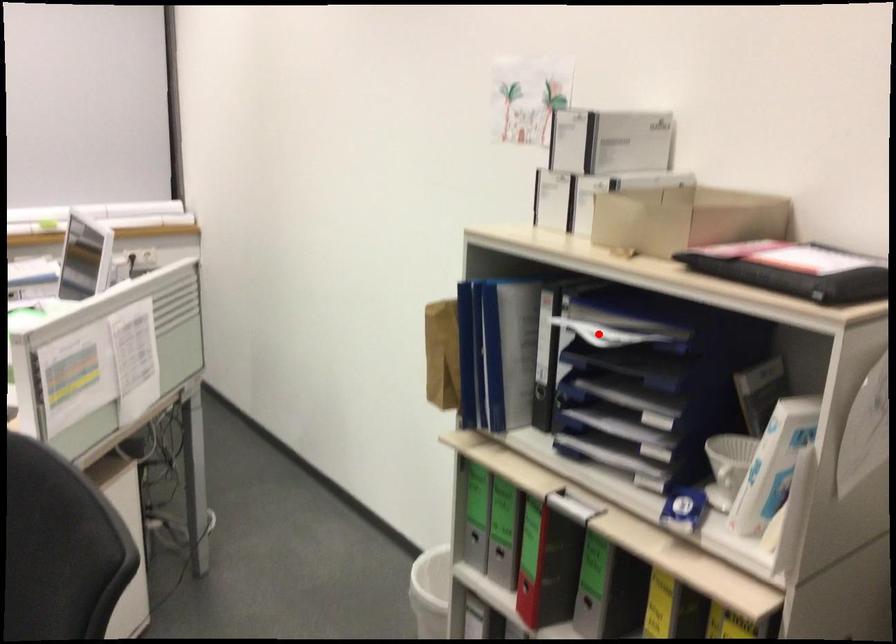
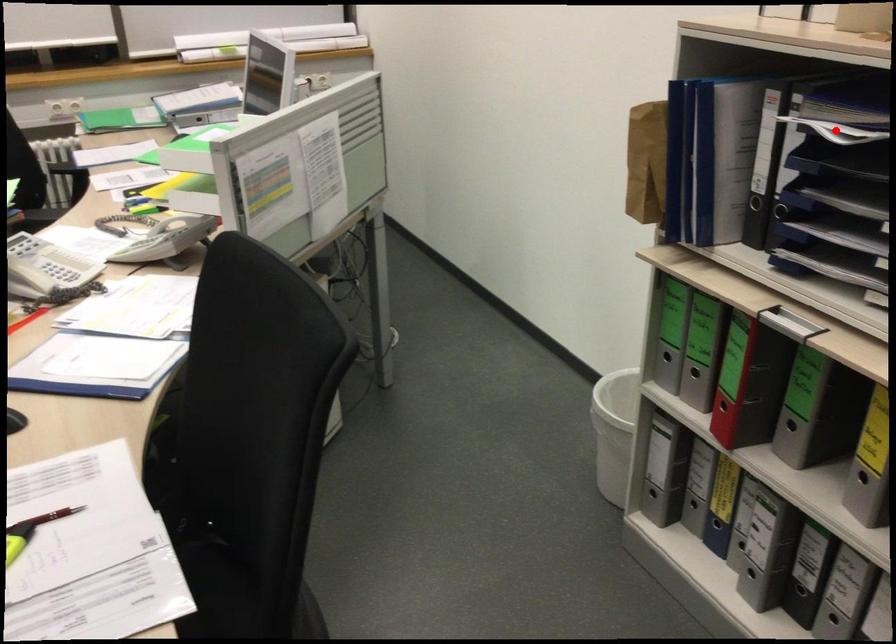
I am providing you with two images of the same scene from different viewpoints. A red point is marked on the first image and another point is marked on the second image. Is the red point in image1 aligned with the point shown in image2?

Yes